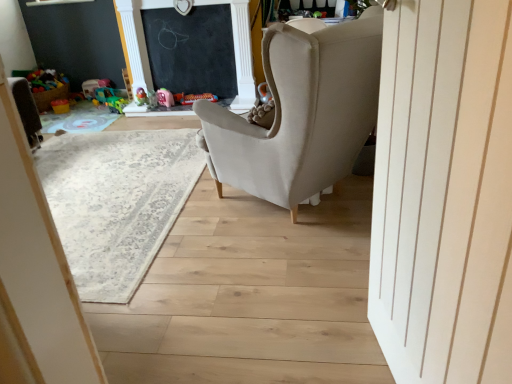
The image size is (512, 384). Find the location of `vacant space to the right of matte orange toy at center, placed as the sixth toy when sorted from right to left`. vacant space to the right of matte orange toy at center, placed as the sixth toy when sorted from right to left is located at coordinates (80, 107).